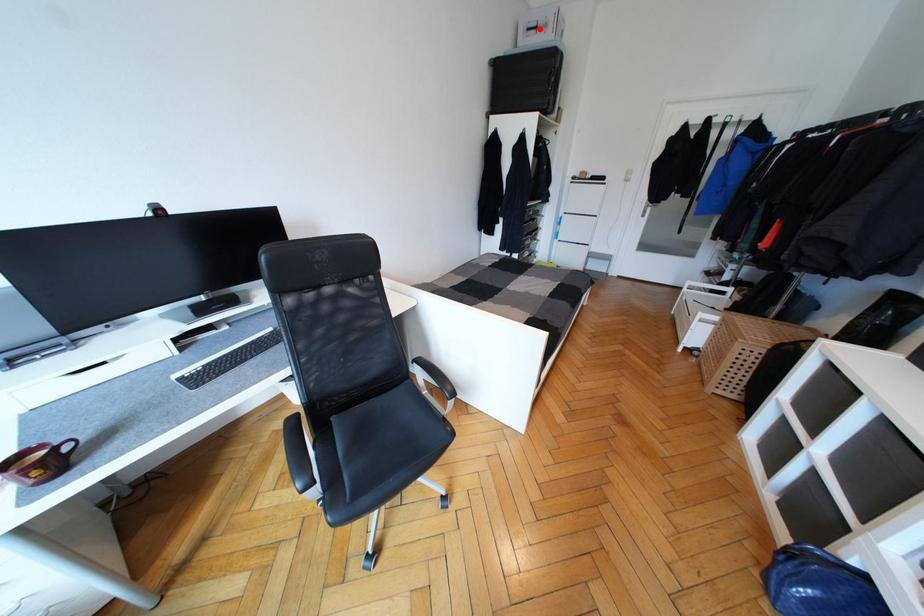
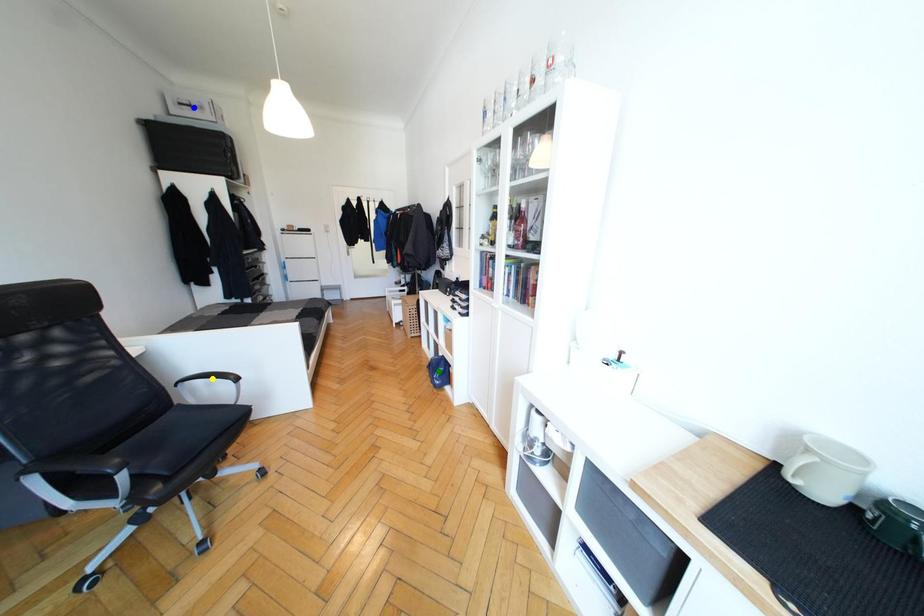
Question: I am providing you with two images of the same scene from different viewpoints. A red point is marked on the first image. You are given multiple points on the second image. Can you choose the point in image 2 that corresponds to the point in image 1?

Choices:
 (A) yellow point
 (B) blue point
 (C) green point

Answer: (B)